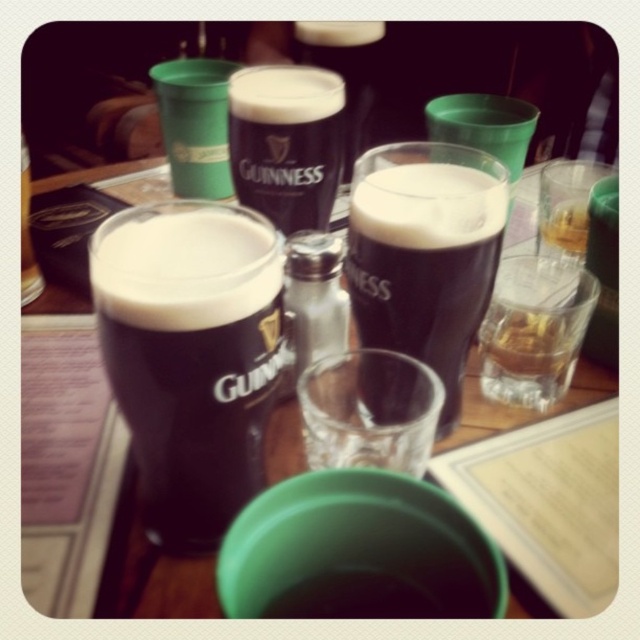
How much distance is there between guinness stout glass at center and translucent glass at upper right?

guinness stout glass at center and translucent glass at upper right are 8.87 inches apart from each other.

Does point (244, 163) come behind point (580, 180)?

No, (244, 163) is closer to viewer.

Locate an element on the screen. Image resolution: width=640 pixels, height=640 pixels. guinness stout glass at center is located at coordinates (285, 141).

Can you confirm if dark matte guinness pint at center is positioned to the left of transparent glass at center?

Indeed, dark matte guinness pint at center is positioned on the left side of transparent glass at center.

Is dark matte guinness pint at center bigger than transparent glass at center?

Yes.

Which is in front, point (122, 308) or point (412, 362)?

Positioned in front is point (122, 308).

The width and height of the screenshot is (640, 640). In order to click on dark matte guinness pint at center in this screenshot , I will do `click(189, 355)`.

Does point (454, 352) lie in front of point (342, 416)?

That is True.

Consider the image. Is dark glass stout at center smaller than transparent glass at center?

Actually, dark glass stout at center might be larger than transparent glass at center.

You are a GUI agent. You are given a task and a screenshot of the screen. Output one action in this format:
    pyautogui.click(x=<x>, y=<y>)
    Task: Click on the dark glass stout at center
    Image resolution: width=640 pixels, height=640 pixels.
    Given the screenshot: What is the action you would take?
    pyautogui.click(x=424, y=264)